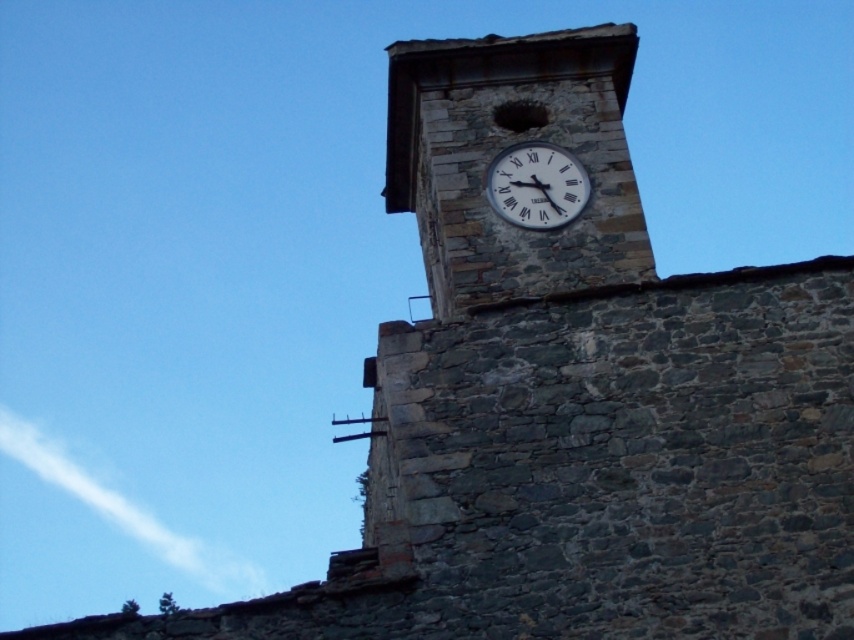
You are an architect examining the stone building. You need to determine if the rustic stone clock tower at upper center can accommodate a new decorative element that requires the same width as the white matte clock at upper center. Based on the scene, will the tower have enough space?

The rustic stone clock tower at upper center is wider than the white matte clock at upper center, so it can accommodate the decorative element requiring the same width as the clock.

You are standing in front of the stone building and notice the rustic stone clock tower at upper center and the white matte clock at upper center. Which object is positioned more to the left?

The rustic stone clock tower at upper center is positioned more to the left than the white matte clock at upper center.

You are standing in front of a stone building and notice a rustic stone clock tower at upper center. Where exactly is the clock tower positioned relative to the small rectangular opening to its left?

The rustic stone clock tower at upper center is located at point (506, 147), which means it is positioned to the right of the small rectangular opening since its x coordinate is higher than the opening.